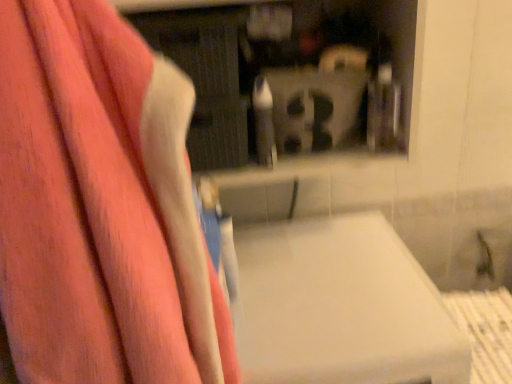
Question: Is matte plastic shelf at upper center oriented towards pink fabric towel at left?

Choices:
 (A) yes
 (B) no

Answer: (A)

Question: Is matte plastic shelf at upper center located outside pink fabric towel at left?

Choices:
 (A) yes
 (B) no

Answer: (A)

Question: Is there a large distance between matte plastic shelf at upper center and pink fabric towel at left?

Choices:
 (A) no
 (B) yes

Answer: (A)

Question: Are matte plastic shelf at upper center and pink fabric towel at left making contact?

Choices:
 (A) yes
 (B) no

Answer: (B)

Question: Can you confirm if matte plastic shelf at upper center is bigger than pink fabric towel at left?

Choices:
 (A) no
 (B) yes

Answer: (B)

Question: Would you say white matte lift at center is inside or outside matte plastic shelf at upper center?

Choices:
 (A) inside
 (B) outside

Answer: (B)

Question: From the image's perspective, is white matte lift at center above or below matte plastic shelf at upper center?

Choices:
 (A) above
 (B) below

Answer: (B)

Question: Based on their sizes in the image, would you say white matte lift at center is bigger or smaller than matte plastic shelf at upper center?

Choices:
 (A) small
 (B) big

Answer: (B)

Question: Looking at their shapes, would you say white matte lift at center is wider or thinner than matte plastic shelf at upper center?

Choices:
 (A) wide
 (B) thin

Answer: (A)

Question: From the image's perspective, relative to matte plastic shelf at upper center, is pink fabric towel at left above or below?

Choices:
 (A) above
 (B) below

Answer: (B)

Question: In the image, is pink fabric towel at left positioned in front of or behind matte plastic shelf at upper center?

Choices:
 (A) front
 (B) behind

Answer: (A)

Question: From a real-world perspective, relative to matte plastic shelf at upper center, is pink fabric towel at left vertically above or below?

Choices:
 (A) below
 (B) above

Answer: (A)

Question: Considering the positions of pink fabric towel at left and matte plastic shelf at upper center in the image, is pink fabric towel at left taller or shorter than matte plastic shelf at upper center?

Choices:
 (A) tall
 (B) short

Answer: (A)

Question: Considering the positions of white matte lift at center and pink fabric towel at left in the image, is white matte lift at center taller or shorter than pink fabric towel at left?

Choices:
 (A) tall
 (B) short

Answer: (B)

Question: In the image, is white matte lift at center positioned in front of or behind pink fabric towel at left?

Choices:
 (A) front
 (B) behind

Answer: (B)